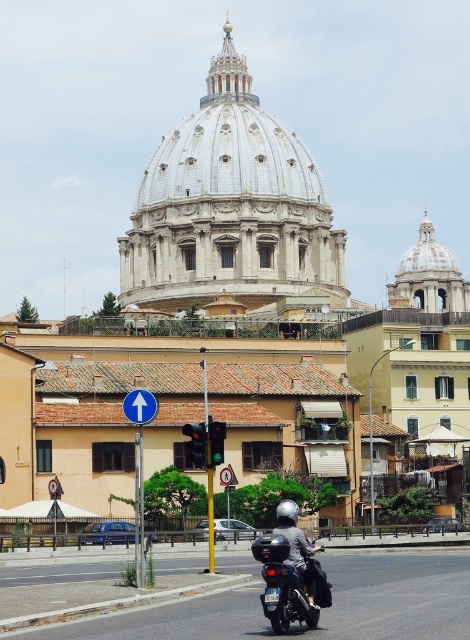
Question: Can you confirm if blue metallic signpost at upper center is positioned to the left of silver metallic helmet at center?

Choices:
 (A) yes
 (B) no

Answer: (A)

Question: Among these objects, which one is farthest from the camera?

Choices:
 (A) silver metallic helmet at center
 (B) blue metallic signpost at upper center
 (C) shiny black motorcycle at center
 (D) white marble dome at center

Answer: (D)

Question: Can you confirm if shiny black motorcycle at center is positioned above silver metallic helmet at center?

Choices:
 (A) no
 (B) yes

Answer: (B)

Question: Is blue metallic signpost at upper center behind silver metallic helmet at center?

Choices:
 (A) no
 (B) yes

Answer: (B)

Question: Which of these objects is positioned closest to the blue metallic signpost at upper center?

Choices:
 (A) white marble dome at center
 (B) shiny black motorcycle at center

Answer: (B)

Question: Which point is closer to the camera?

Choices:
 (A) (295, 536)
 (B) (319, 586)

Answer: (B)